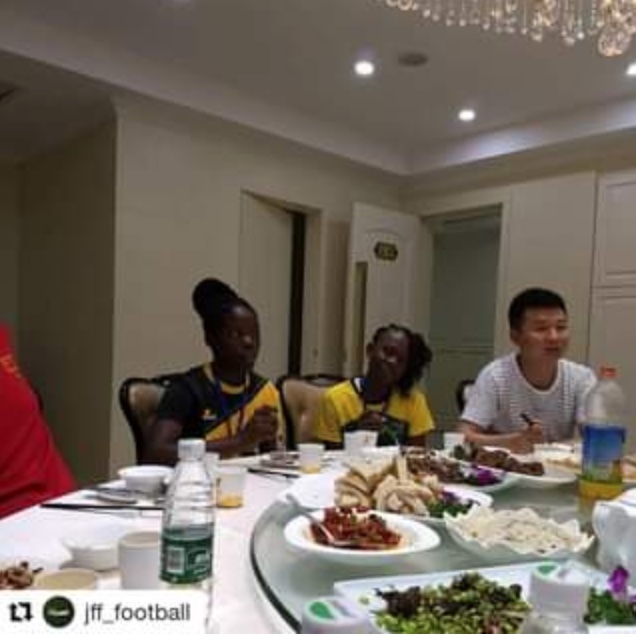
At what (x,y) coordinates should I click in order to perform the action: click on door. Please return your answer as a coordinate pair (x, y). Image resolution: width=636 pixels, height=638 pixels. Looking at the image, I should click on click(x=391, y=286).